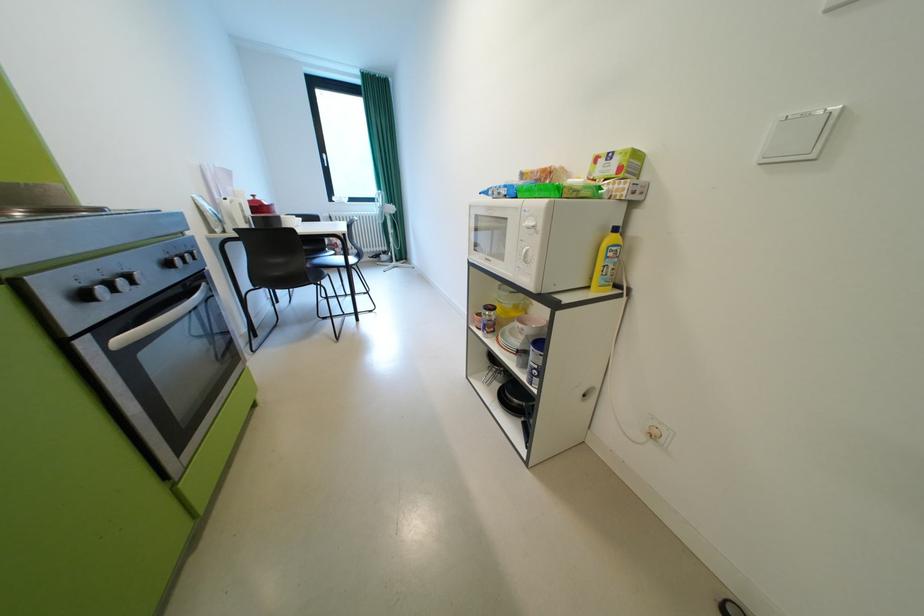
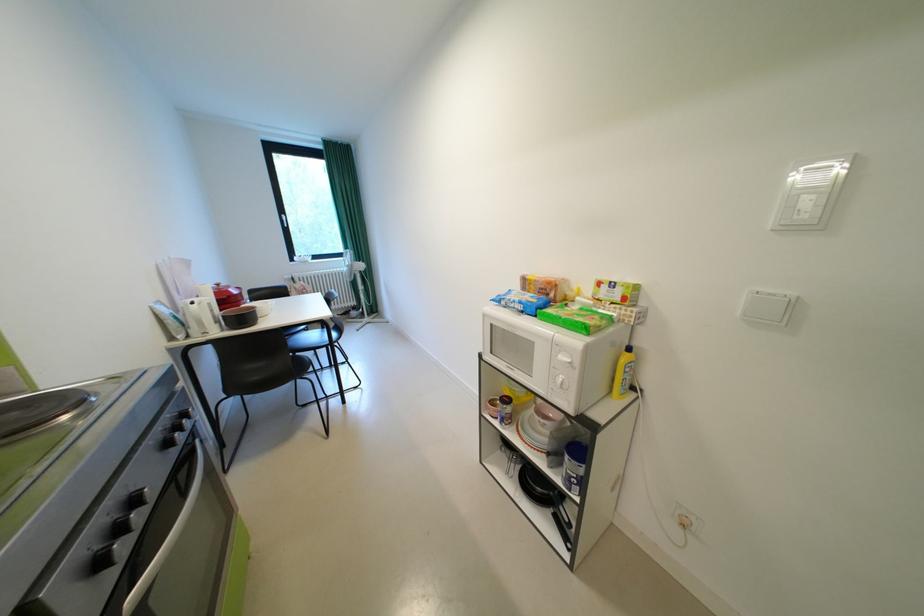
Where in the second image is the point corresponding to pixel 178 265 from the first image?

(176, 446)